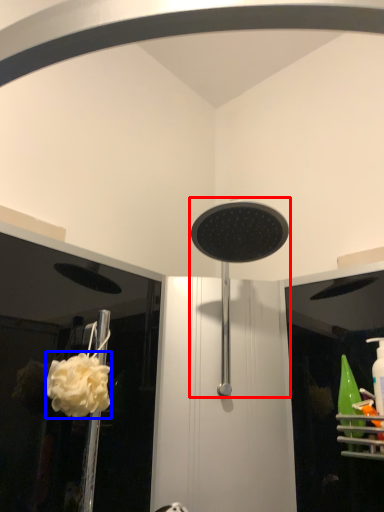
Question: Which of the following is the farthest to the observer, shower (highlighted by a red box) or flower (highlighted by a blue box)?

Choices:
 (A) shower
 (B) flower

Answer: (B)